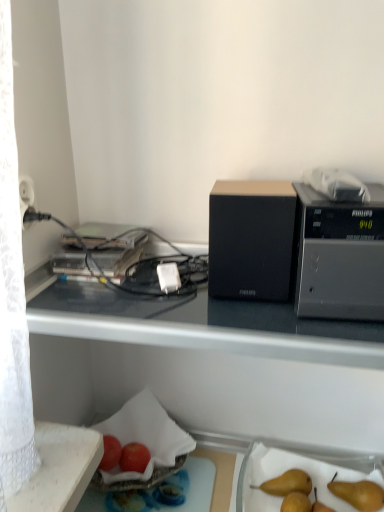
Where is `unoccupied region to the right of red matte apple at lower left, the first apple viewed from the left`? This screenshot has height=512, width=384. unoccupied region to the right of red matte apple at lower left, the first apple viewed from the left is located at coordinates (177, 484).